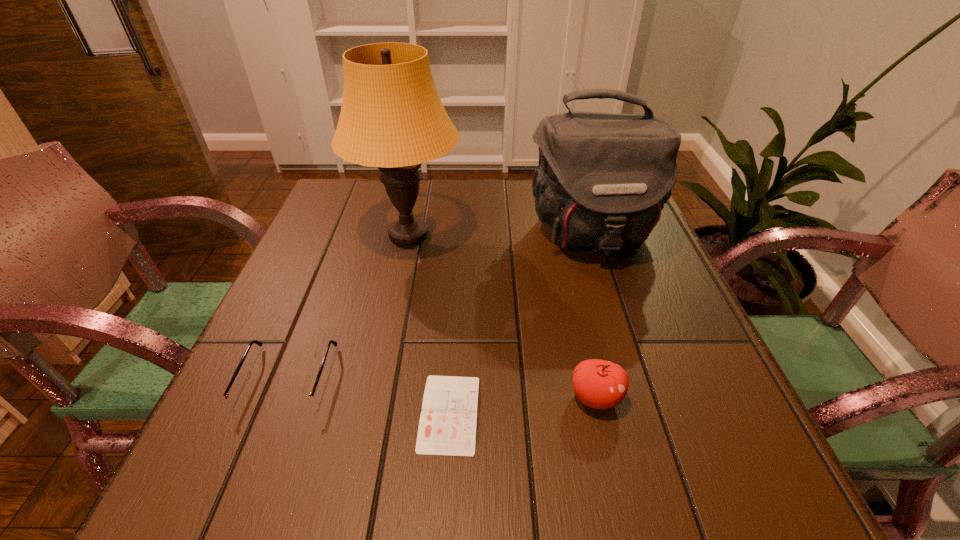
In the image, there is a desktop. Where is `vacant space at the left edge`? Image resolution: width=960 pixels, height=540 pixels. vacant space at the left edge is located at coordinates (335, 275).

In the image, there is a desktop. Where is `vacant region at the right edge`? The height and width of the screenshot is (540, 960). vacant region at the right edge is located at coordinates (634, 291).

Identify the location of free space at the far left corner. (338, 181).

Where is `free space between the apple and the lampshade`? free space between the apple and the lampshade is located at coordinates (502, 316).

Identify the location of empty location between the lampshade and the shortest object. (429, 324).

This screenshot has height=540, width=960. Identify the location of free space between the fourth shortest object and the shortest object. (520, 324).

Find the location of a particular element. empty space between the lampshade and the spectacles is located at coordinates (348, 307).

This screenshot has width=960, height=540. What are the coordinates of `empty space that is in between the lampshade and the fourth shortest object` in the screenshot? It's located at click(x=499, y=234).

The image size is (960, 540). I want to click on free space that is in between the tallest object and the diary, so click(x=429, y=324).

Where is `free point between the apple and the second tallest object`? free point between the apple and the second tallest object is located at coordinates (593, 316).